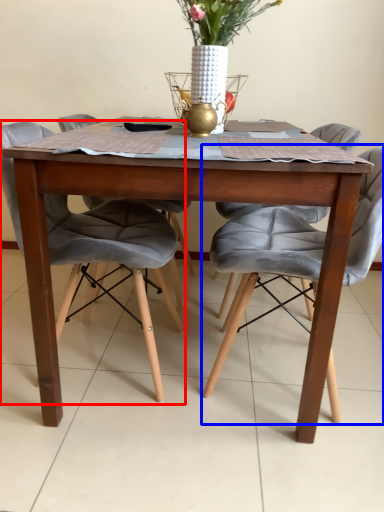
Question: Which point is closer to the camera, chair (highlighted by a red box) or chair (highlighted by a blue box)?

Choices:
 (A) chair
 (B) chair

Answer: (B)